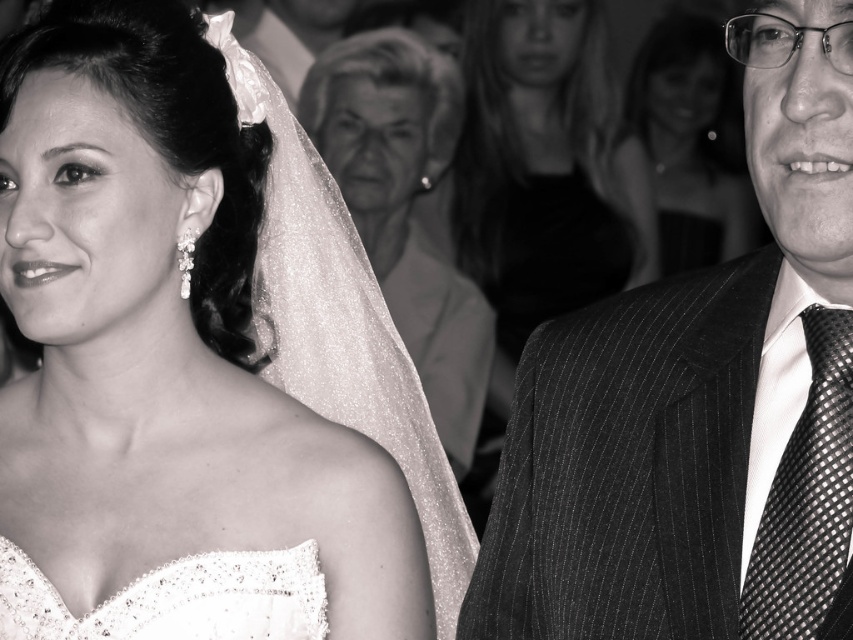
Question: Can you confirm if matte white dress at left is positioned to the right of satin lace wedding dress at lower left?

Choices:
 (A) yes
 (B) no

Answer: (B)

Question: Does pinstriped suit at center have a greater width compared to smooth skin face at upper right?

Choices:
 (A) no
 (B) yes

Answer: (A)

Question: Which point is closer to the camera?

Choices:
 (A) matte white dress at left
 (B) smooth skin face at upper right
 (C) smooth silk dress at center
 (D) satin lace wedding dress at lower left

Answer: (D)

Question: Considering the relative positions of matte white dress at left and smooth silk dress at center in the image provided, where is matte white dress at left located with respect to smooth silk dress at center?

Choices:
 (A) right
 (B) left

Answer: (B)

Question: Which object appears farthest from the camera in this image?

Choices:
 (A) smooth silk dress at center
 (B) smooth skin face at upper right
 (C) black textured tie at right

Answer: (B)

Question: Among these points, which one is nearest to the camera?

Choices:
 (A) (345, 173)
 (B) (183, 132)

Answer: (B)